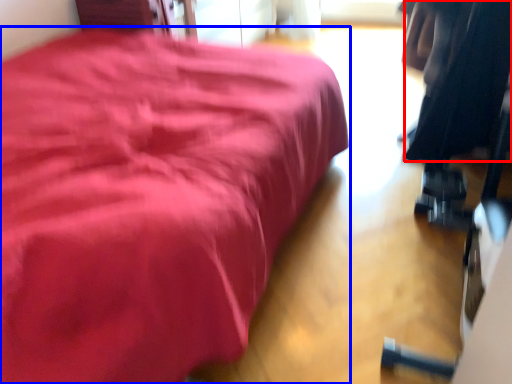
Question: Which of the following is the farthest to the observer, clothing (highlighted by a red box) or furniture (highlighted by a blue box)?

Choices:
 (A) clothing
 (B) furniture

Answer: (A)